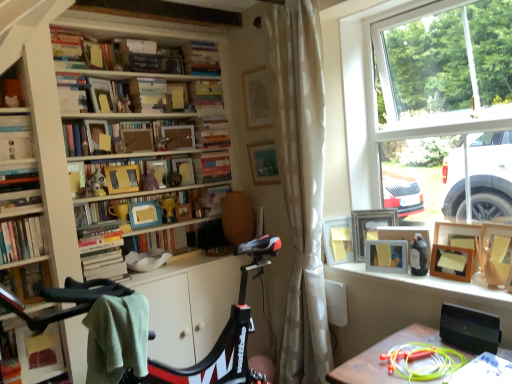
This screenshot has width=512, height=384. I want to click on free location above wooden frame at upper right (from a real-world perspective), so click(409, 274).